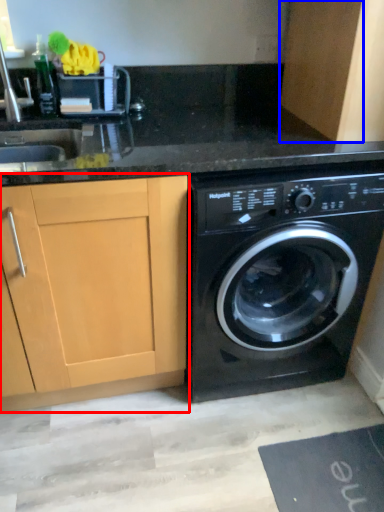
Question: Which object is further to the camera taking this photo, cabinetry (highlighted by a red box) or cabinetry (highlighted by a blue box)?

Choices:
 (A) cabinetry
 (B) cabinetry

Answer: (B)